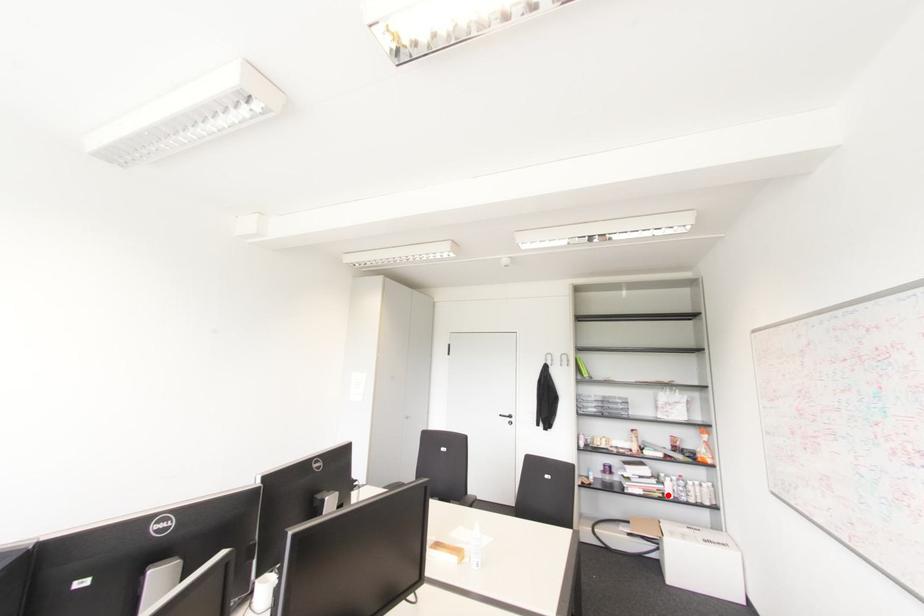
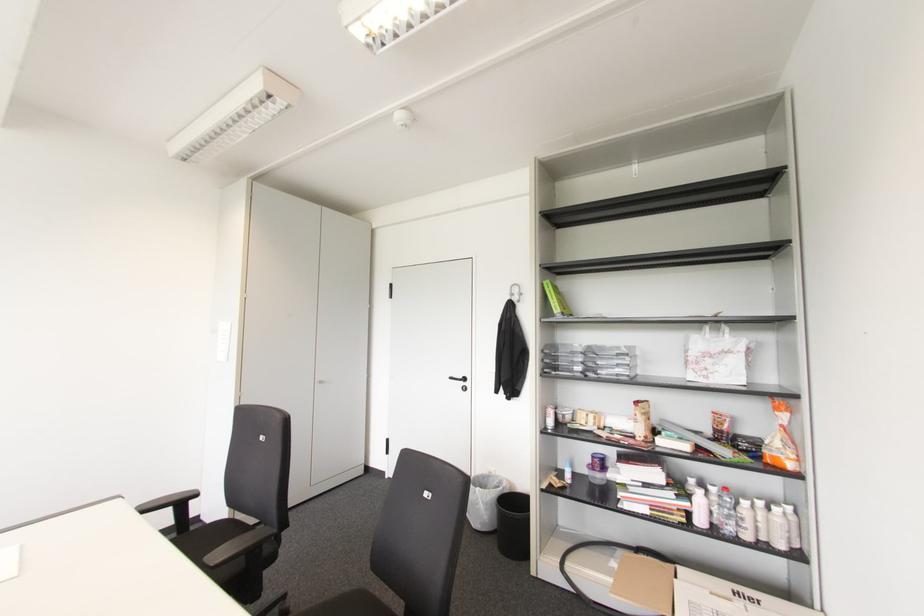
Question: I am providing you with two images of the same scene from different viewpoints. Image1 has a red point marked. In image2, the corresponding 3D location appears at what relative position? Reply with the corresponding letter.

Choices:
 (A) Closer
 (B) Farther

Answer: (A)